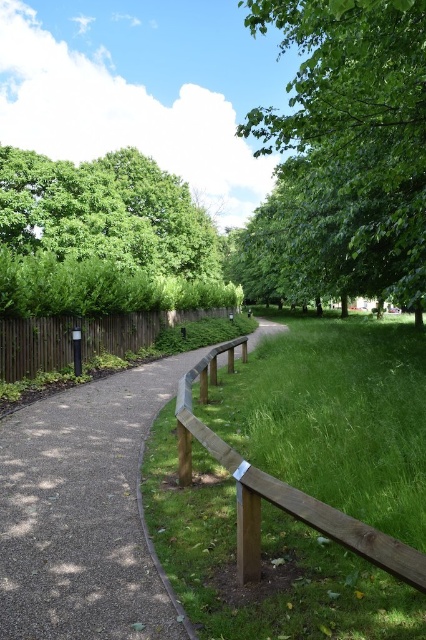
Locate an element on the screen. Image resolution: width=426 pixels, height=640 pixels. green leafy tree at upper center is located at coordinates (354, 134).

Is green leafy tree at upper center thinner than green leafy tree at upper left?

Incorrect, green leafy tree at upper center's width is not less than green leafy tree at upper left's.

Does point (414, 44) come in front of point (199, 230)?

Yes, point (414, 44) is in front of point (199, 230).

Where is `green leafy tree at upper center`? Image resolution: width=426 pixels, height=640 pixels. green leafy tree at upper center is located at coordinates (354, 134).

Who is positioned more to the left, green grass at center or brown wooden fence at left?

Positioned to the left is brown wooden fence at left.

Does green grass at center appear on the left side of brown wooden fence at left?

In fact, green grass at center is to the right of brown wooden fence at left.

Between point (175, 458) and point (57, 330), which one is positioned behind?

The point (57, 330) is behind.

Locate an element on the screen. green grass at center is located at coordinates (334, 417).

Is green leafy tree at upper center smaller than brown wooden fence at left?

Actually, green leafy tree at upper center might be larger than brown wooden fence at left.

Does green leafy tree at upper center have a greater height compared to brown wooden fence at left?

Indeed, green leafy tree at upper center has a greater height compared to brown wooden fence at left.

Who is more distant from viewer, (408, 124) or (212, 312)?

Point (212, 312)

Identify the location of green leafy tree at upper center. (354, 134).